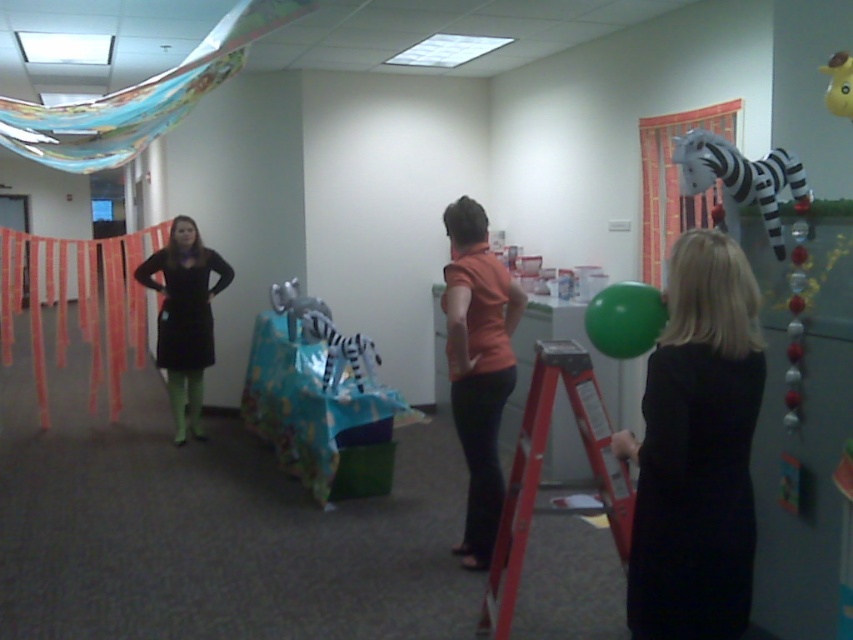
You are organizing a party and need to decide which item to place on a small shelf. The shelf can only hold items that are not too large. Which item between the black matte dress at left and the plush fabric zebra at right should you choose?

The plush fabric zebra at right should be chosen because the black matte dress at left has a larger size, making it unsuitable for the small shelf.

You are standing in the office room and want to place a decoration between the two points, point (498, 474) and point (621, 326). Which point is closer to you so you can start placing the decoration from there?

Point (498, 474) is further to the camera than point (621, 326), so the closer point to you is point (621, 326). Start placing the decoration from point (621, 326).

In the scene shown: You are a photographer standing in the center of the room. You need to take a photo that includes both the black matte dress at right and the black matte dress at left. Based on their positions, is it possible to capture both in a single frame without moving the dresses?

The black matte dress at right is 3.87 meters away from the black matte dress at left. Since the distance between them is 3.87 meters, it is possible to capture both in a single frame without moving the dresses as long as the camera has a wide enough angle or you position yourself appropriately.